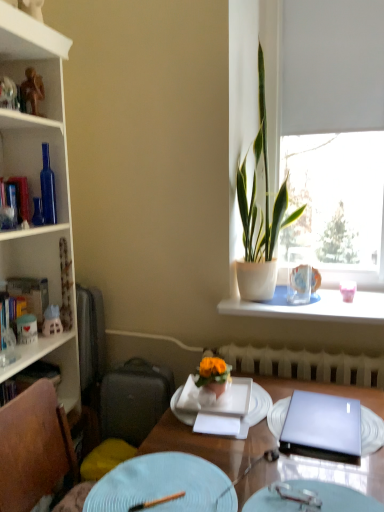
Locate an element on the screen. This screenshot has width=384, height=512. free space between light blue ceramic plate at center, marked as the 2th plate in a front-to-back arrangement, and white paper at center is located at coordinates (201, 443).